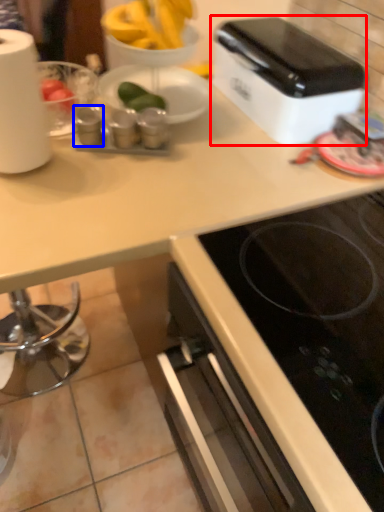
Question: Which of the following is the farthest to the observer, toaster (highlighted by a red box) or appliance (highlighted by a blue box)?

Choices:
 (A) toaster
 (B) appliance

Answer: (B)